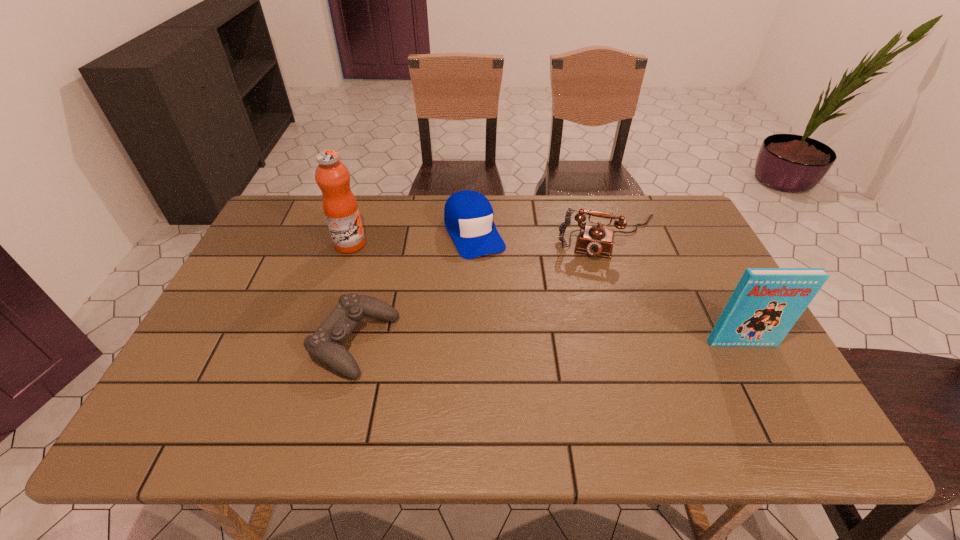
Where is `object positioned at the near edge`? The image size is (960, 540). object positioned at the near edge is located at coordinates (325, 344).

What are the coordinates of `book that is at the right edge` in the screenshot? It's located at pos(766,303).

Find the location of a particular element. The height and width of the screenshot is (540, 960). telephone that is at the right edge is located at coordinates (595, 240).

Where is `object at the far right corner`? This screenshot has width=960, height=540. object at the far right corner is located at coordinates (595, 240).

This screenshot has width=960, height=540. In order to click on vacant area at the far edge of the desktop in this screenshot , I will do [x=629, y=238].

Identify the location of vacant space at the near edge of the desktop. (251, 381).

The height and width of the screenshot is (540, 960). I want to click on vacant space at the left edge of the desktop, so (254, 308).

Identify the location of free region at the right edge. Image resolution: width=960 pixels, height=540 pixels. (702, 292).

At what (x,y) coordinates should I click in order to perform the action: click on free space at the far right corner. Please return your answer as a coordinate pair (x, y). This screenshot has width=960, height=540. Looking at the image, I should click on (651, 228).

You are a GUI agent. You are given a task and a screenshot of the screen. Output one action in this format:
    pyautogui.click(x=<x>, y=<y>)
    Task: Click on the free space between the third object from right to left and the fruit juice
    
    Given the screenshot: What is the action you would take?
    pyautogui.click(x=412, y=238)